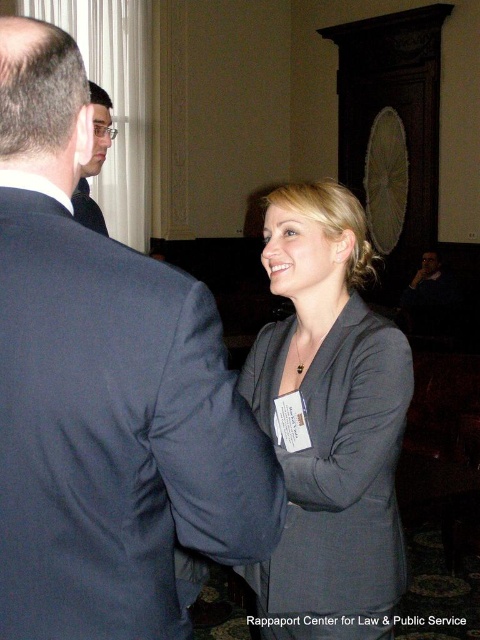
How far apart are matte gray blazer at center and dark blue suit at lower right?

matte gray blazer at center is 14.90 feet from dark blue suit at lower right.

Does matte gray blazer at center come behind dark blue suit at lower right?

That is False.

Is point (287, 349) positioned before point (404, 291)?

That is True.

You are a GUI agent. You are given a task and a screenshot of the screen. Output one action in this format:
    pyautogui.click(x=<x>, y=<y>)
    Task: Click on the matte gray blazer at center
    The image size is (480, 640).
    Given the screenshot: What is the action you would take?
    pyautogui.click(x=328, y=422)

Based on the photo, is matte gray blazer at center shorter than matte black suit at left?

No.

Is matte gray blazer at center thinner than matte black suit at left?

Yes.

Who is more forward, (348, 531) or (94, 145)?

Point (348, 531) is more forward.

Locate an element on the screen. matte gray blazer at center is located at coordinates (328, 422).

Does dark blue suit at lower right have a lesser width compared to matte black suit at left?

No.

Does dark blue suit at lower right appear on the right side of matte black suit at left?

Yes, dark blue suit at lower right is to the right of matte black suit at left.

Between point (455, 300) and point (107, 140), which one is positioned behind?

Point (455, 300)

This screenshot has height=640, width=480. I want to click on dark blue suit at lower right, so click(x=431, y=300).